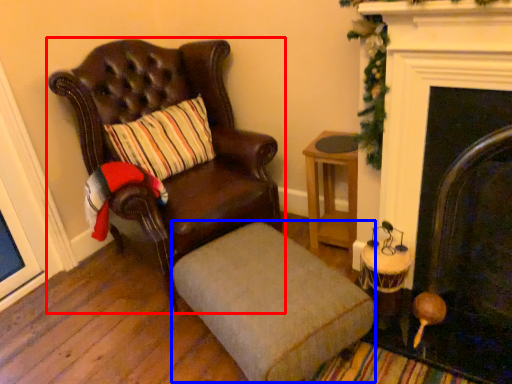
Question: Which object is further to the camera taking this photo, chair (highlighted by a red box) or footrest (highlighted by a blue box)?

Choices:
 (A) chair
 (B) footrest

Answer: (A)